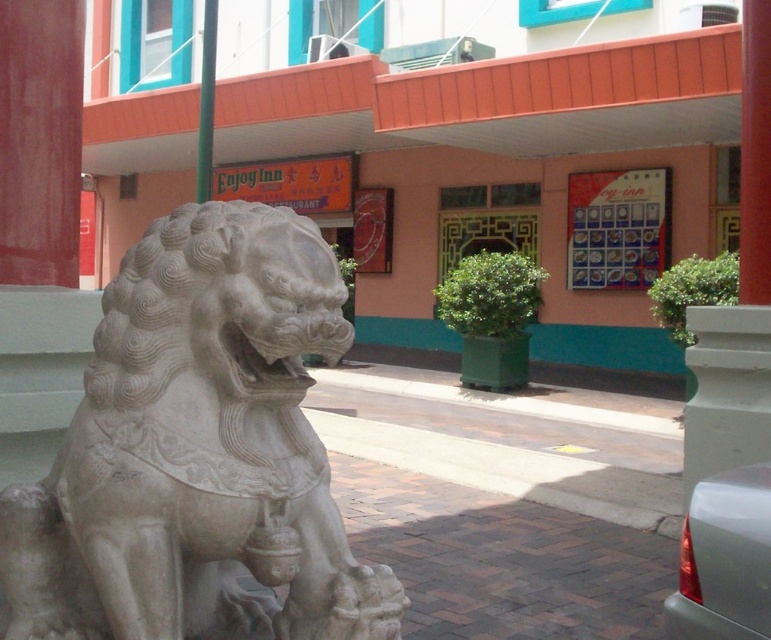
You are standing in front of the traditional Chinese stone lion statue and want to place two markers at the coordinates point (719, 547) and point (749, 92). Which marker will appear closer to you when viewed from your current position?

Point (719, 547) is closer to the viewer than point (749, 92), so the marker at point (719, 547) will appear closer to you.

You are a delivery driver who needs to park your satin silver car at lower right close to the white stone lion at left for unloading. Is there enough space between them to open the car door?

The white stone lion at left might be wider than the satin silver car at lower right, so there might not be enough space to open the car door safely. Please check the exact dimensions before parking.

You are standing in front of the traditional Chinese stone lion statue and want to take a photo of the red matte pillar at center. Since the white stone lion at left is blocking your view, can you step to the right to get a clear shot? Please explain why based on their positions.

The white stone lion at left is closer to the viewer than the red matte pillar at center. By stepping to the right, you can move around the closer white stone lion at left to get an unobstructed view of the red matte pillar at center.